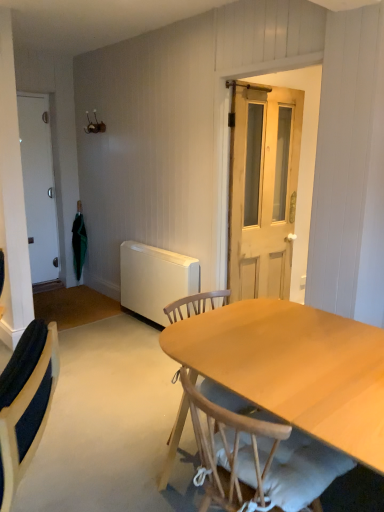
You are a GUI agent. You are given a task and a screenshot of the screen. Output one action in this format:
    pyautogui.click(x=<x>, y=<y>)
    Task: Click on the free point above light brown wooden door at center, which is counted as the 1th door, starting from the front (from a real-world perspective)
    
    Given the screenshot: What is the action you would take?
    pyautogui.click(x=276, y=87)